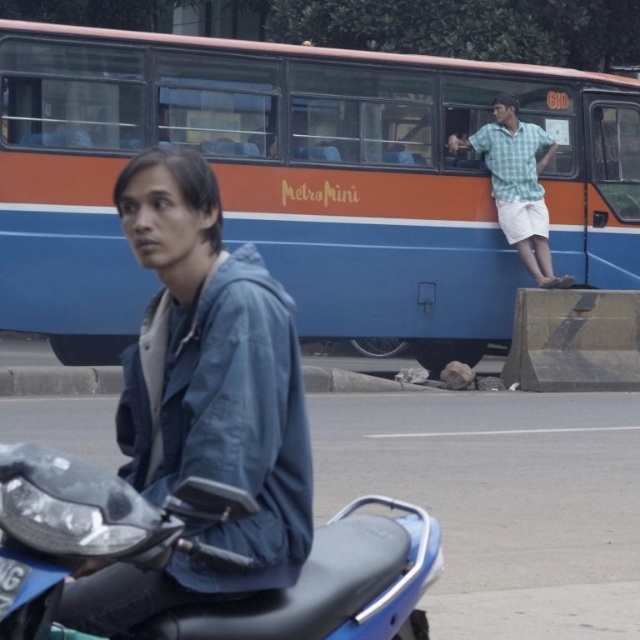
Question: Can you confirm if blue matte bus at upper center is smaller than blue matte motorcycle at lower left?

Choices:
 (A) yes
 (B) no

Answer: (A)

Question: Which point is closer to the camera taking this photo?

Choices:
 (A) (211, 250)
 (B) (532, 236)
 (C) (307, 109)

Answer: (A)

Question: Considering the relative positions of blue matte jacket at center and light green checkered shirt at upper right in the image provided, where is blue matte jacket at center located with respect to light green checkered shirt at upper right?

Choices:
 (A) left
 (B) right

Answer: (A)

Question: Which point is farther to the camera?

Choices:
 (A) (564, 280)
 (B) (186, 113)

Answer: (A)

Question: Which of these objects is positioned closest to the blue matte jacket at center?

Choices:
 (A) blue matte bus at upper center
 (B) light green checkered shirt at upper right
 (C) blue matte motorcycle at lower left

Answer: (C)

Question: Is blue matte bus at upper center to the right of light green checkered shirt at upper right from the viewer's perspective?

Choices:
 (A) yes
 (B) no

Answer: (B)